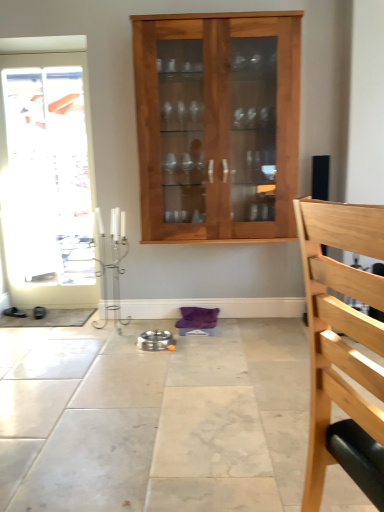
Find the location of a particular element. space that is in front of black leather shoes at lower left is located at coordinates (10, 322).